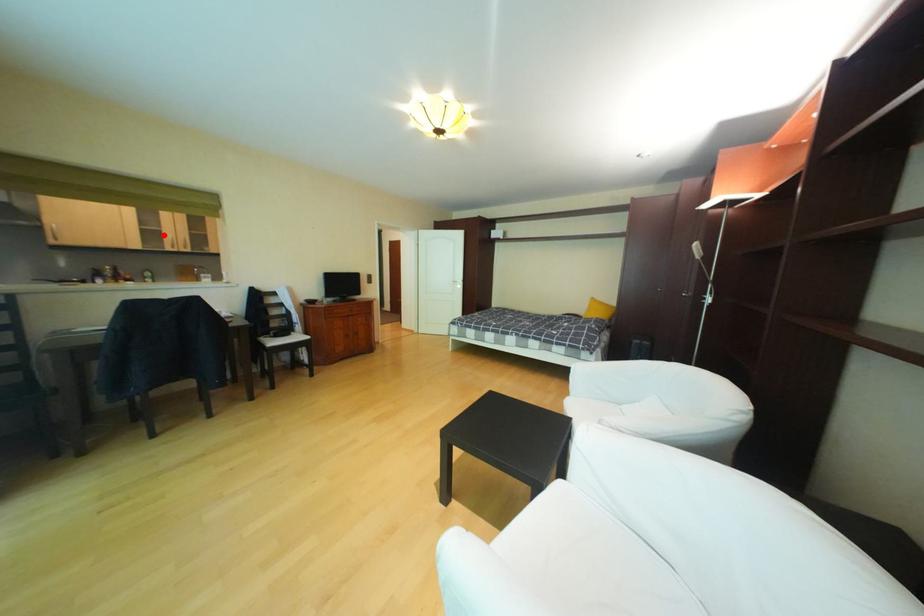
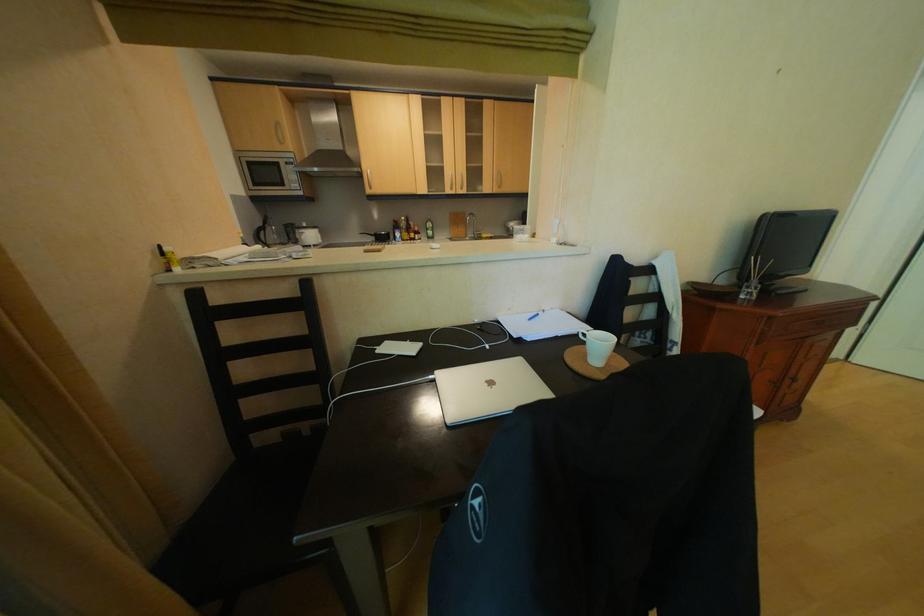
Where in the second image is the point corresponding to the highlighted location from the first image?

(446, 174)